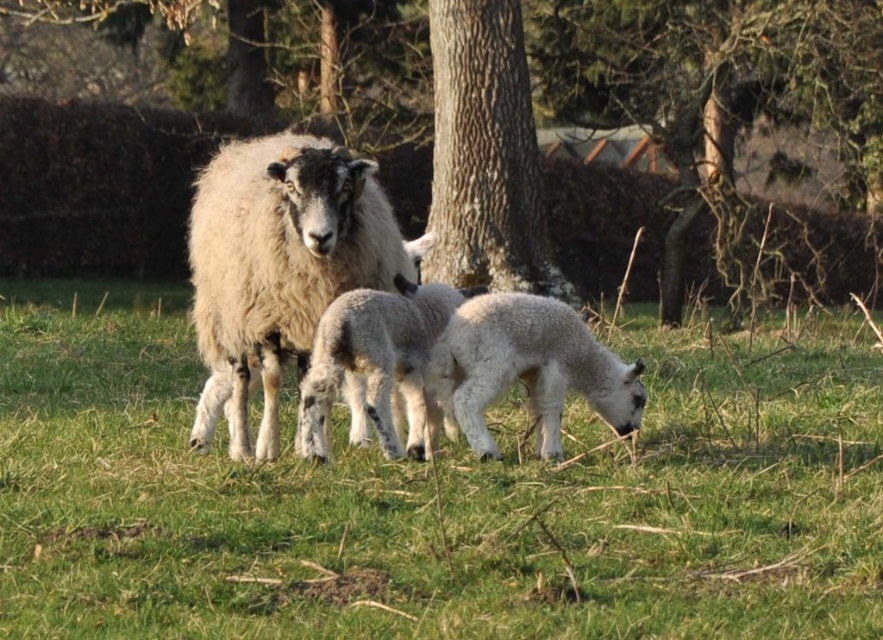
Which is behind, point (275, 276) or point (537, 234)?

Point (537, 234)

Which of these two, fuzzy white sheep at center or rough bark tree at center, stands taller?

rough bark tree at center is taller.

Is point (270, 285) in front of point (525, 72)?

Yes, point (270, 285) is in front of point (525, 72).

Where is `fuzzy white sheep at center`? Image resolution: width=883 pixels, height=640 pixels. fuzzy white sheep at center is located at coordinates (278, 266).

The width and height of the screenshot is (883, 640). Describe the element at coordinates (487, 154) in the screenshot. I see `rough bark tree at center` at that location.

Find the location of a particular element. The image size is (883, 640). rough bark tree at center is located at coordinates (487, 154).

Can you confirm if white fluffy lamb at center is smaller than white woolen lamb at center?

Yes.

From the picture: Is white fluffy lamb at center to the right of white woolen lamb at center from the viewer's perspective?

Correct, you'll find white fluffy lamb at center to the right of white woolen lamb at center.

Is point (541, 387) in front of point (376, 371)?

That is False.

The image size is (883, 640). I want to click on white fluffy lamb at center, so click(527, 369).